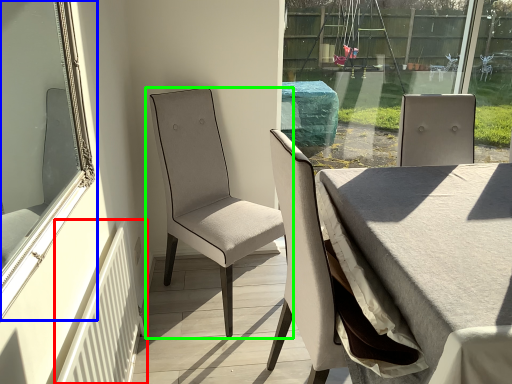
Question: Which is farther away from radiator (highlighted by a red box)? window (highlighted by a blue box) or chair (highlighted by a green box)?

Choices:
 (A) window
 (B) chair

Answer: (B)